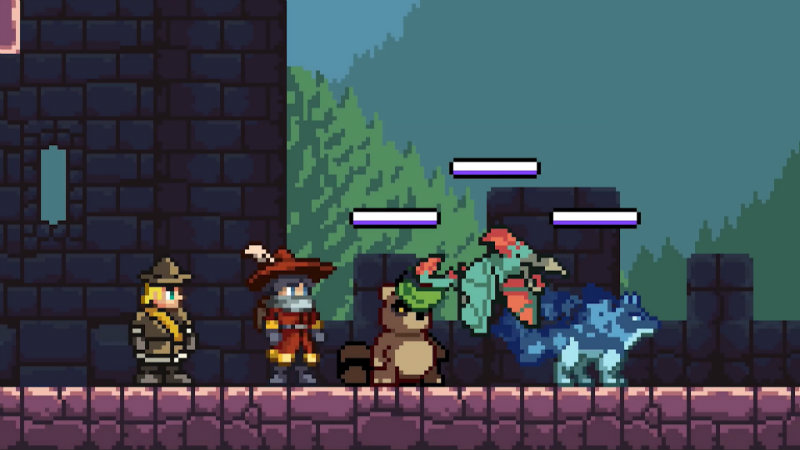
At what (x,y) coordinates should I click in order to perform the action: click on window. Please return your answer as a coordinate pair (x, y). The width and height of the screenshot is (800, 450). Looking at the image, I should click on (46, 180).